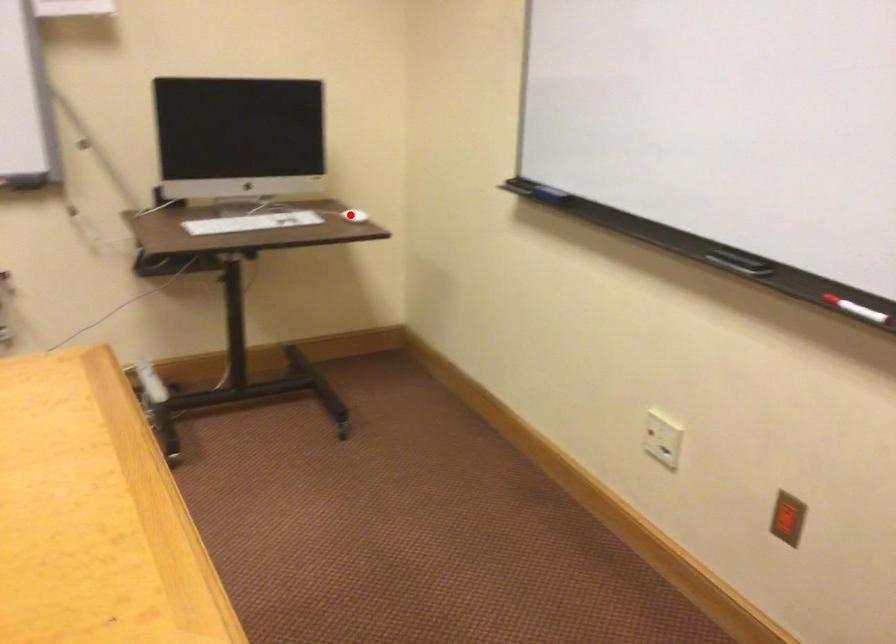
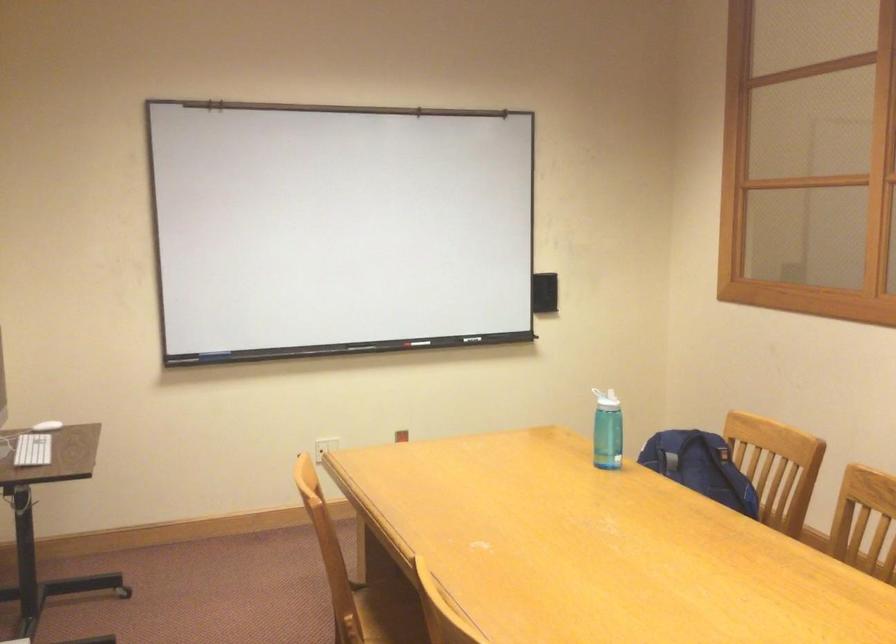
Find the pixel in the second image that matches the highlighted location in the first image.

(47, 426)